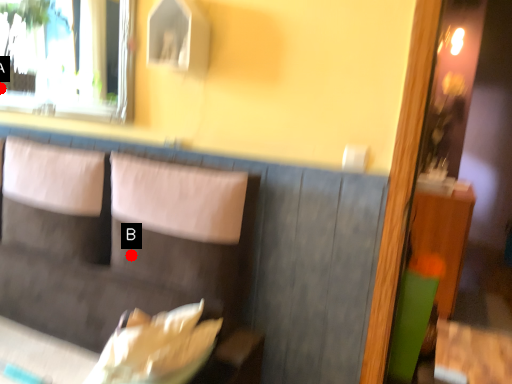
Question: Two points are circled on the image, labeled by A and B beside each circle. Which point is closer to the camera?

Choices:
 (A) A is closer
 (B) B is closer

Answer: (B)